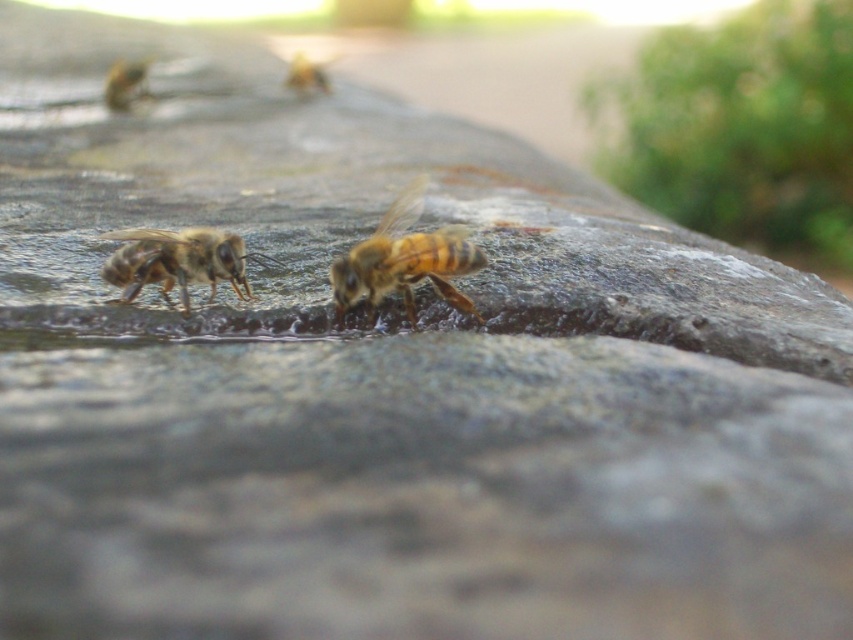
Does brown fuzzy bee at center have a smaller size compared to translucent golden bee at upper center?

Yes, brown fuzzy bee at center is smaller than translucent golden bee at upper center.

Which is in front, point (183, 253) or point (312, 81)?

Positioned in front is point (183, 253).

This screenshot has height=640, width=853. Describe the element at coordinates (178, 260) in the screenshot. I see `brown fuzzy bee at center` at that location.

Locate an element on the screen. This screenshot has height=640, width=853. brown fuzzy bee at center is located at coordinates (178, 260).

I want to click on translucent golden honeybee at upper left, so click(125, 83).

Can you confirm if translucent golden honeybee at upper left is positioned to the right of translucent golden bee at upper center?

Incorrect, translucent golden honeybee at upper left is not on the right side of translucent golden bee at upper center.

Is point (134, 92) less distant than point (305, 84)?

Yes, it is.

Find the location of a particular element. translucent golden honeybee at upper left is located at coordinates (125, 83).

Is yellow-brown fuzzy bee at center behind translucent golden bee at upper center?

No, yellow-brown fuzzy bee at center is closer to the viewer.

Does yellow-brown fuzzy bee at center appear over translucent golden bee at upper center?

Actually, yellow-brown fuzzy bee at center is below translucent golden bee at upper center.

Is point (469, 259) closer to camera compared to point (291, 58)?

Yes, it is.

The width and height of the screenshot is (853, 640). In order to click on yellow-brown fuzzy bee at center in this screenshot , I will do `click(405, 259)`.